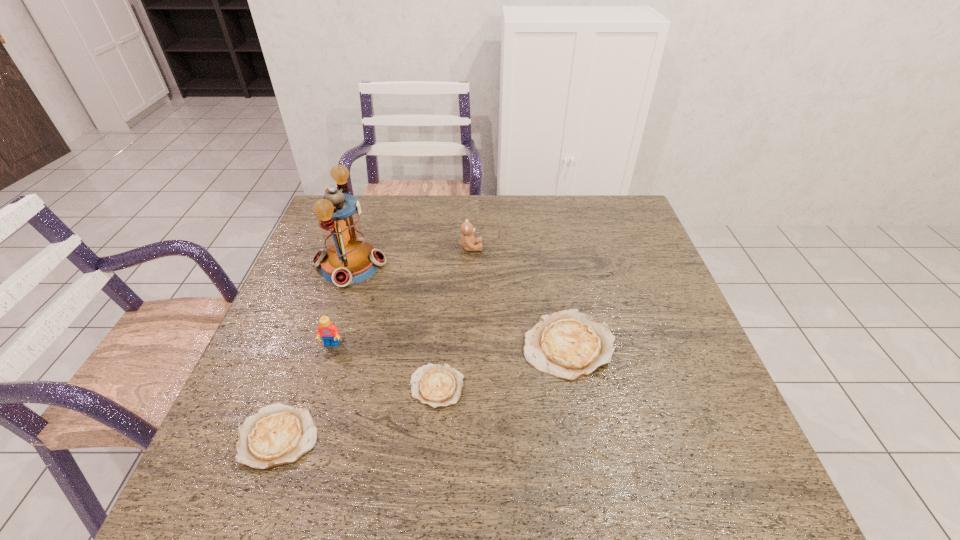
In the current image, all quiches are evenly spaced. To maintain this equal spacing, where should an additional quiche be placed on the right? Please point out a free spot. Please provide its 2D coordinates. Your answer should be formatted as a tuple, i.e. [(x, y)], where the tuple contains the x and y coordinates of a point satisfying the conditions above.

[(681, 309)]